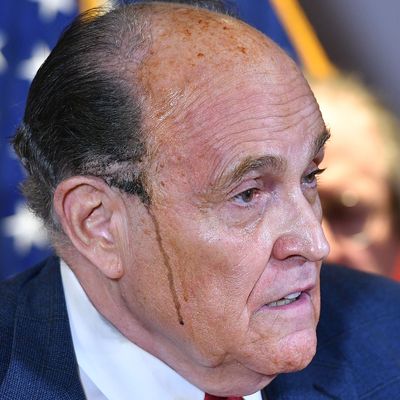
Where is `blue cloth`? Image resolution: width=400 pixels, height=400 pixels. blue cloth is located at coordinates (17, 35), (10, 200).